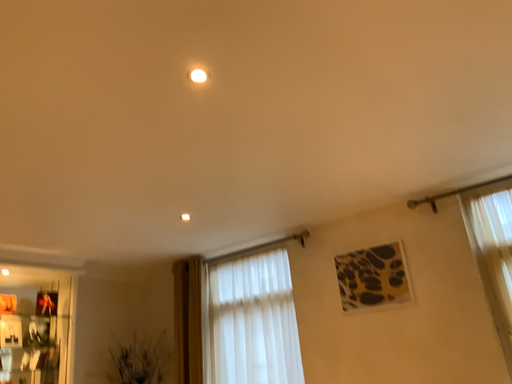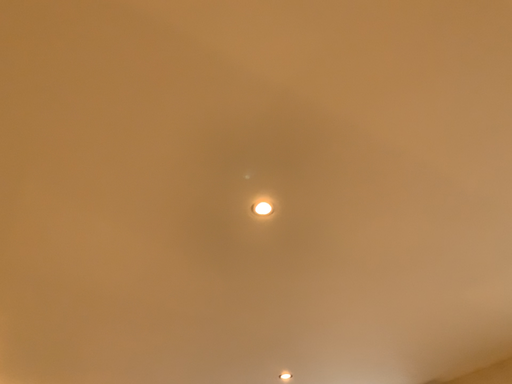
Question: Which way did the camera rotate in the video?

Choices:
 (A) rotated left
 (B) rotated right

Answer: (A)